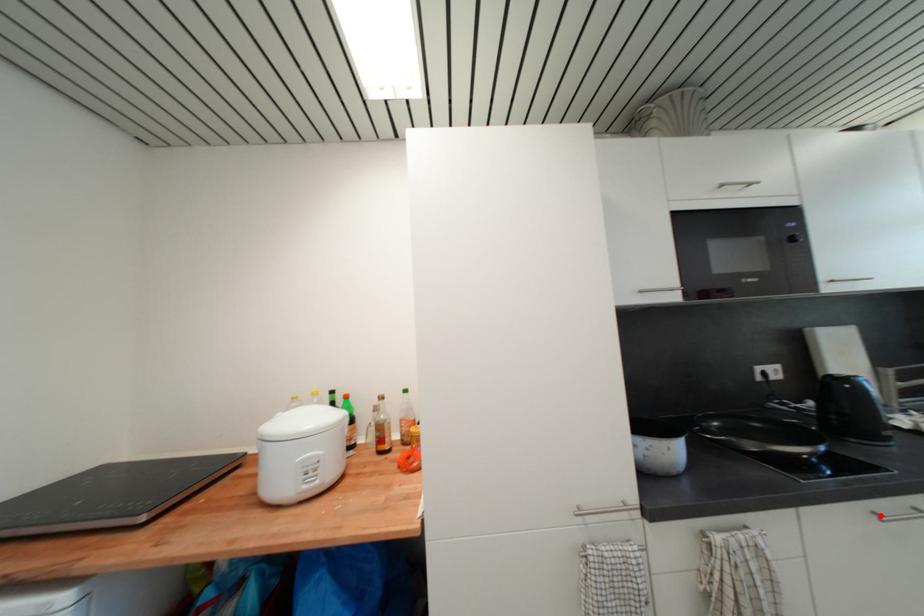
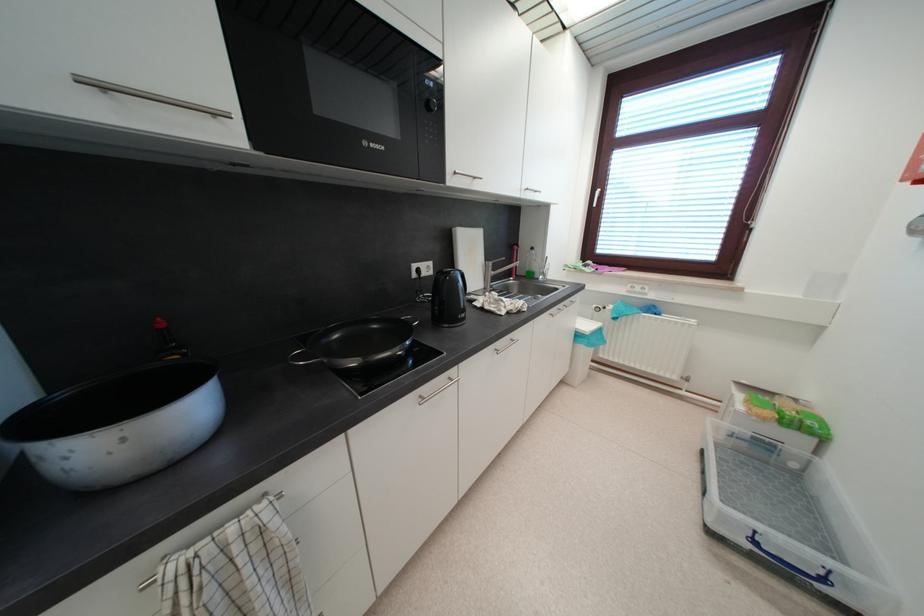
In the second image, find the point that corresponds to the highlighted location in the first image.

(427, 400)